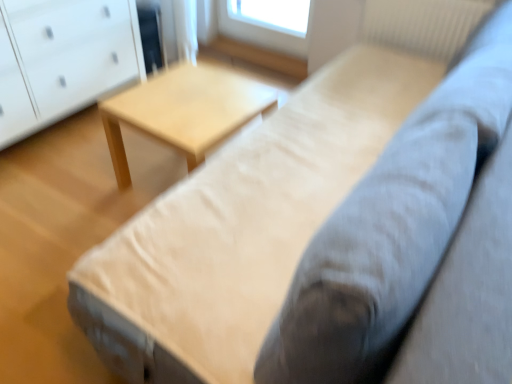
This screenshot has width=512, height=384. What do you see at coordinates (423, 24) in the screenshot?
I see `white textured radiator at upper right` at bounding box center [423, 24].

This screenshot has width=512, height=384. Identify the location of light wood table at center. (184, 111).

Is white textured radiator at upper right at the right side of light wood table at center?

Yes, white textured radiator at upper right is to the right of light wood table at center.

Which point is more forward, (452, 56) or (188, 92)?

The point (188, 92) is more forward.

Is light wood table at center located within white textured radiator at upper right?

Definitely not — light wood table at center is not inside white textured radiator at upper right.

In the scene shown: Does white textured radiator at upper right turn towards light wood table at center?

Yes, white textured radiator at upper right is facing light wood table at center.

Is white textured radiator at upper right completely or partially inside light wood table at center?

No, white textured radiator at upper right is not a part of light wood table at center.

Does point (148, 86) come in front of point (403, 17)?

Yes, it is.

Which object is wider, light wood table at center or white textured radiator at upper right?

With larger width is light wood table at center.

Is there a large distance between light wood table at center and white textured radiator at upper right?

Yes, light wood table at center is far from white textured radiator at upper right.

Is white textured radiator at upper right thinner than white glossy chest of drawers at left?

Yes, white textured radiator at upper right is thinner than white glossy chest of drawers at left.

Considering the sizes of white textured radiator at upper right and white glossy chest of drawers at left in the image, is white textured radiator at upper right taller or shorter than white glossy chest of drawers at left?

white textured radiator at upper right is shorter than white glossy chest of drawers at left.

Is white textured radiator at upper right inside or outside of white glossy chest of drawers at left?

white textured radiator at upper right cannot be found inside white glossy chest of drawers at left.

Locate an element on the screen. table below the white glossy chest of drawers at left (from the image's perspective) is located at coordinates (184, 111).

Does light wood table at center turn towards white glossy chest of drawers at left?

No.

Is light wood table at center closer to the viewer compared to white glossy chest of drawers at left?

Yes, light wood table at center is closer to the camera.

Is white glossy chest of drawers at left next to light wood table at center and touching it?

No, white glossy chest of drawers at left is not making contact with light wood table at center.

From the image's perspective, would you say white glossy chest of drawers at left is shown under light wood table at center?

Actually, white glossy chest of drawers at left appears above light wood table at center in the image.

Is white glossy chest of drawers at left inside the boundaries of light wood table at center, or outside?

white glossy chest of drawers at left is not inside light wood table at center, it's outside.

Can you confirm if white glossy chest of drawers at left is thinner than white textured radiator at upper right?

Incorrect, the width of white glossy chest of drawers at left is not less than that of white textured radiator at upper right.

Based on the photo, considering the sizes of objects white glossy chest of drawers at left and white textured radiator at upper right in the image provided, who is taller, white glossy chest of drawers at left or white textured radiator at upper right?

white glossy chest of drawers at left is taller.

Which of these two, white glossy chest of drawers at left or white textured radiator at upper right, is smaller?

white textured radiator at upper right is smaller.

The width and height of the screenshot is (512, 384). In order to click on chest of drawers to the left of white textured radiator at upper right in this screenshot , I will do `click(66, 59)`.

Find the location of a particular element. table below the white textured radiator at upper right (from the image's perspective) is located at coordinates (184, 111).

The height and width of the screenshot is (384, 512). In order to click on radiator that is on the right side of light wood table at center in this screenshot , I will do `click(423, 24)`.

From the image, which object appears to be farther from white textured radiator at upper right, light wood table at center or white glossy chest of drawers at left?

white glossy chest of drawers at left is positioned further to the anchor white textured radiator at upper right.

Estimate the real-world distances between objects in this image. Which object is further from light wood table at center, white textured radiator at upper right or white glossy chest of drawers at left?

white textured radiator at upper right lies further to light wood table at center than the other object.

Estimate the real-world distances between objects in this image. Which object is further from white glossy chest of drawers at left, white textured radiator at upper right or light wood table at center?

The object further to white glossy chest of drawers at left is white textured radiator at upper right.

Considering their positions, is white glossy chest of drawers at left positioned further to light wood table at center than white textured radiator at upper right?

white textured radiator at upper right is positioned further to the anchor light wood table at center.

Estimate the real-world distances between objects in this image. Which object is further from white textured radiator at upper right, white glossy chest of drawers at left or light wood table at center?

Based on the image, white glossy chest of drawers at left appears to be further to white textured radiator at upper right.

Which object lies nearer to the anchor point white glossy chest of drawers at left, light wood table at center or white textured radiator at upper right?

light wood table at center.

Where is `table situated between white glossy chest of drawers at left and white textured radiator at upper right from left to right`? table situated between white glossy chest of drawers at left and white textured radiator at upper right from left to right is located at coordinates (184, 111).